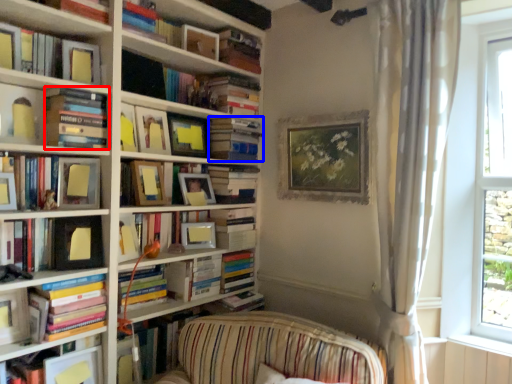
Question: Which point is closer to the camera, book (highlighted by a red box) or book (highlighted by a blue box)?

Choices:
 (A) book
 (B) book

Answer: (A)